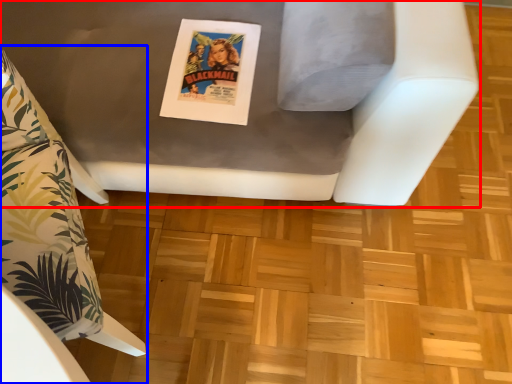
Question: Among these objects, which one is nearest to the camera, furniture (highlighted by a red box) or furniture (highlighted by a blue box)?

Choices:
 (A) furniture
 (B) furniture

Answer: (A)